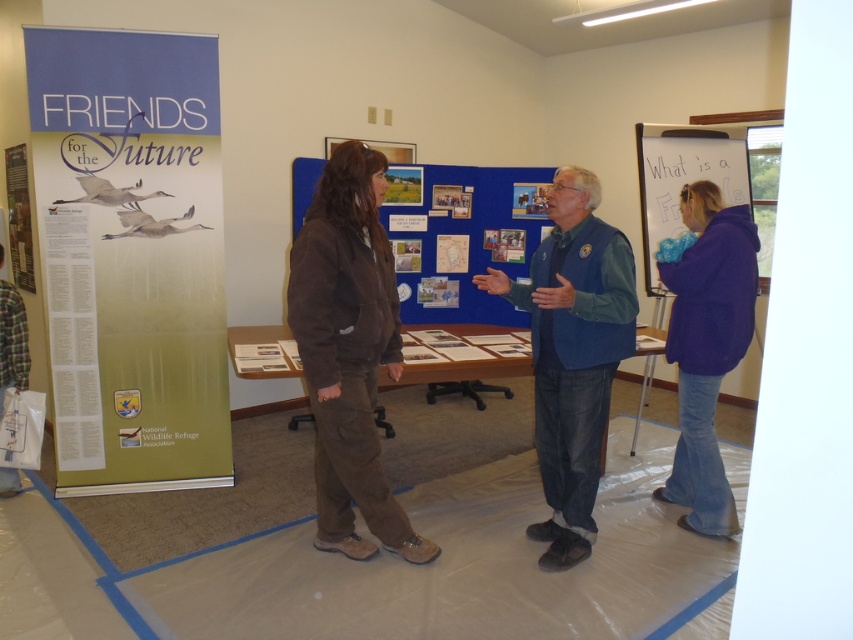
You are standing at the entrance of the room and see the blue fleece vest at center and the vertical banner on the left. Which object is closer to you?

The blue fleece vest at center is closer to you because they are 8.21 feet apart, so the one at center is nearer than the banner on the left.